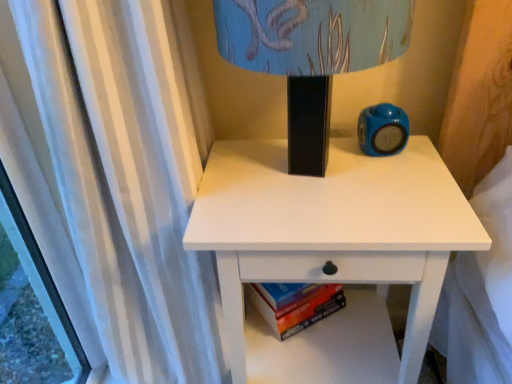
Find the location of a particular element. matte plastic alarm clock at upper right is located at coordinates (382, 130).

Find the location of `hardcover book at lower center`. hardcover book at lower center is located at coordinates (295, 304).

At what (x,y) coordinates should I click in order to perform the action: click on matte black lampshade at upper center. Please return your answer as a coordinate pair (x, y). Image resolution: width=512 pixels, height=384 pixels. Looking at the image, I should click on (311, 55).

The image size is (512, 384). Identify the location of matte plastic alarm clock at upper right. (382, 130).

Does matte plastic alarm clock at upper right turn towards white matte nightstand at center?

No, matte plastic alarm clock at upper right is not aimed at white matte nightstand at center.

Is matte plastic alarm clock at upper right to the right of white matte nightstand at center from the viewer's perspective?

Yes.

From a real-world perspective, between matte plastic alarm clock at upper right and white matte nightstand at center, who is vertically lower?

white matte nightstand at center is physically lower.

Based on the photo, from the image's perspective, who appears lower, matte plastic alarm clock at upper right or hardcover book at lower center?

From the image's view, hardcover book at lower center is below.

Considering the relative positions of matte plastic alarm clock at upper right and hardcover book at lower center in the image provided, is matte plastic alarm clock at upper right to the right of hardcover book at lower center from the viewer's perspective?

Correct, you'll find matte plastic alarm clock at upper right to the right of hardcover book at lower center.

From the picture: Is matte plastic alarm clock at upper right beside hardcover book at lower center?

matte plastic alarm clock at upper right and hardcover book at lower center are clearly separated.

Between matte plastic alarm clock at upper right and hardcover book at lower center, which one has larger size?

With larger size is hardcover book at lower center.

Between white matte nightstand at center and matte black lampshade at upper center, which one has more height?

white matte nightstand at center is taller.

Is point (409, 268) less distant than point (277, 22)?

No, it is behind (277, 22).

Find the location of a particular element. The width and height of the screenshot is (512, 384). nightstand on the right of matte black lampshade at upper center is located at coordinates (332, 224).

Is matte black lampshade at upper center taller than hardcover book at lower center?

Yes.

Is matte black lampshade at upper center facing away from hardcover book at lower center?

No, matte black lampshade at upper center is not facing the opposite direction of hardcover book at lower center.

This screenshot has width=512, height=384. In order to click on table lamp that appears in front of the hardcover book at lower center in this screenshot , I will do `click(311, 55)`.

From a real-world perspective, which is physically below, matte black lampshade at upper center or hardcover book at lower center?

From a 3D spatial view, hardcover book at lower center is below.

This screenshot has height=384, width=512. Identify the location of paperback book behind the matte plastic alarm clock at upper right. (x=295, y=304).

Would you say matte plastic alarm clock at upper right is part of hardcover book at lower center's contents?

No, matte plastic alarm clock at upper right is not a part of hardcover book at lower center.

Is point (345, 301) closer to viewer compared to point (367, 141)?

No.

From the image's perspective, does matte plastic alarm clock at upper right appear lower than matte black lampshade at upper center?

Indeed, from the image's perspective, matte plastic alarm clock at upper right is shown beneath matte black lampshade at upper center.

Would you say matte plastic alarm clock at upper right is to the left or to the right of matte black lampshade at upper center in the picture?

matte plastic alarm clock at upper right is positioned on matte black lampshade at upper center's right side.

Is matte plastic alarm clock at upper right directly adjacent to matte black lampshade at upper center?

No, matte plastic alarm clock at upper right is not next to matte black lampshade at upper center.

Does matte plastic alarm clock at upper right have a smaller size compared to matte black lampshade at upper center?

Correct, matte plastic alarm clock at upper right occupies less space than matte black lampshade at upper center.

Can you confirm if matte black lampshade at upper center is wider than white matte nightstand at center?

In fact, matte black lampshade at upper center might be narrower than white matte nightstand at center.

Is matte black lampshade at upper center oriented away from white matte nightstand at center?

matte black lampshade at upper center is not turned away from white matte nightstand at center.

From a real-world perspective, is matte black lampshade at upper center positioned above or below white matte nightstand at center?

From a real-world perspective, matte black lampshade at upper center is physically above white matte nightstand at center.

Is the surface of matte black lampshade at upper center in direct contact with white matte nightstand at center?

No.

Where is `teal above the white matte nightstand at center (from a real-world perspective)`? teal above the white matte nightstand at center (from a real-world perspective) is located at coordinates click(382, 130).

At what (x,y) coordinates should I click in order to perform the action: click on paperback book below the matte plastic alarm clock at upper right (from the image's perspective). Please return your answer as a coordinate pair (x, y). This screenshot has width=512, height=384. Looking at the image, I should click on (295, 304).

Based on their spatial positions, is matte black lampshade at upper center or white matte nightstand at center further from matte plastic alarm clock at upper right?

matte black lampshade at upper center is positioned further to the anchor matte plastic alarm clock at upper right.

Looking at the image, which one is located closer to matte plastic alarm clock at upper right, matte black lampshade at upper center or hardcover book at lower center?

matte black lampshade at upper center is closer to matte plastic alarm clock at upper right.

When comparing their distances from matte black lampshade at upper center, does white matte nightstand at center or matte plastic alarm clock at upper right seem closer?

white matte nightstand at center lies closer to matte black lampshade at upper center than the other object.

Which object lies further to the anchor point matte black lampshade at upper center, hardcover book at lower center or matte plastic alarm clock at upper right?

hardcover book at lower center is positioned further to the anchor matte black lampshade at upper center.

Looking at the image, which one is located further to white matte nightstand at center, hardcover book at lower center or matte plastic alarm clock at upper right?

The object further to white matte nightstand at center is hardcover book at lower center.

When comparing their distances from matte plastic alarm clock at upper right, does white matte nightstand at center or matte black lampshade at upper center seem further?

matte black lampshade at upper center.

Considering their positions, is hardcover book at lower center positioned closer to matte black lampshade at upper center than white matte nightstand at center?

Based on the image, white matte nightstand at center appears to be nearer to matte black lampshade at upper center.

Based on their spatial positions, is matte plastic alarm clock at upper right or hardcover book at lower center further from matte black lampshade at upper center?

The object further to matte black lampshade at upper center is hardcover book at lower center.

This screenshot has width=512, height=384. Find the location of `teal between matte black lampshade at upper center and hardcover book at lower center in the up-down direction`. teal between matte black lampshade at upper center and hardcover book at lower center in the up-down direction is located at coordinates (382, 130).

Image resolution: width=512 pixels, height=384 pixels. In order to click on paperback book between matte plastic alarm clock at upper right and white matte nightstand at center in the up-down direction in this screenshot , I will do `click(295, 304)`.

Locate an element on the screen. teal between matte black lampshade at upper center and white matte nightstand at center vertically is located at coordinates (382, 130).

This screenshot has height=384, width=512. Identify the location of paperback book between matte black lampshade at upper center and white matte nightstand at center in the vertical direction. point(295,304).